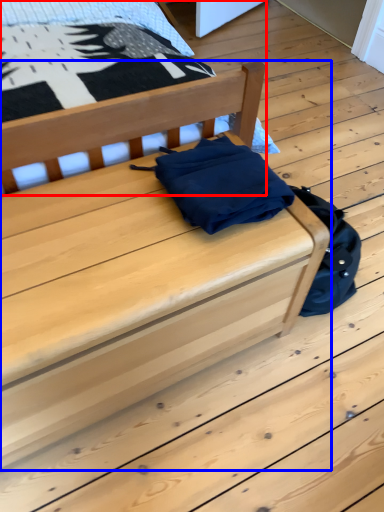
Question: Among these objects, which one is farthest to the camera, furniture (highlighted by a red box) or furniture (highlighted by a blue box)?

Choices:
 (A) furniture
 (B) furniture

Answer: (A)